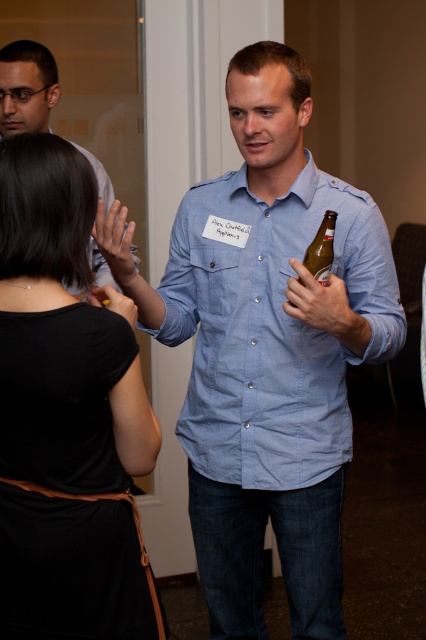
Who is more distant from viewer, (x=106, y=316) or (x=302, y=260)?

Point (x=302, y=260)

From the picture: Does black fabric dress at upper left have a lesser width compared to translucent glass bottle at center?

No, black fabric dress at upper left is not thinner than translucent glass bottle at center.

Who is more distant from viewer, (109, 600) or (308, 250)?

Point (308, 250)

Find the location of a particular element. black fabric dress at upper left is located at coordinates (66, 416).

Is black fabric dress at upper left smaller than matte black shirt at upper left?

Indeed, black fabric dress at upper left has a smaller size compared to matte black shirt at upper left.

Is black fabric dress at upper left below matte black shirt at upper left?

Indeed, black fabric dress at upper left is positioned under matte black shirt at upper left.

Identify the location of black fabric dress at upper left. pos(66,416).

Who is positioned more to the right, blue denim shirt at center or translucent glass bottle at center?

translucent glass bottle at center

Who is taller, blue denim shirt at center or translucent glass bottle at center?

Standing taller between the two is blue denim shirt at center.

Is point (236, 284) behind point (321, 273)?

Yes, it is behind point (321, 273).

Locate an element on the screen. The width and height of the screenshot is (426, 640). blue denim shirt at center is located at coordinates (270, 326).